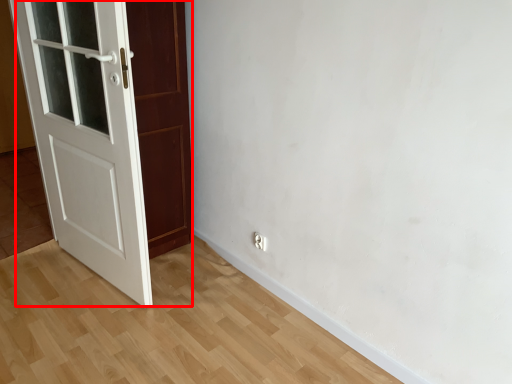
Question: From the image's perspective, considering the relative positions of door (annotated by the red box) and electric outlet in the image provided, where is door (annotated by the red box) located with respect to the staircase?

Choices:
 (A) below
 (B) above

Answer: (B)